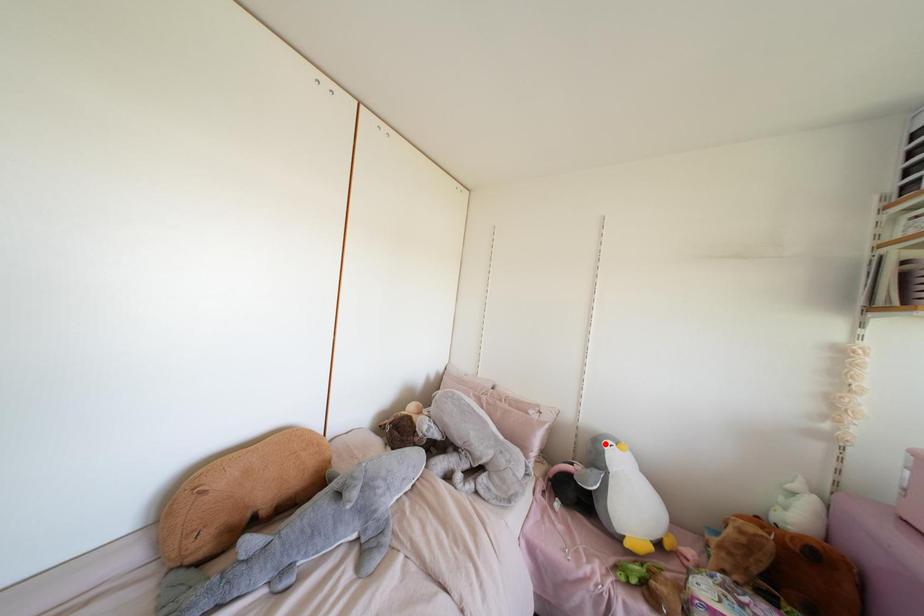
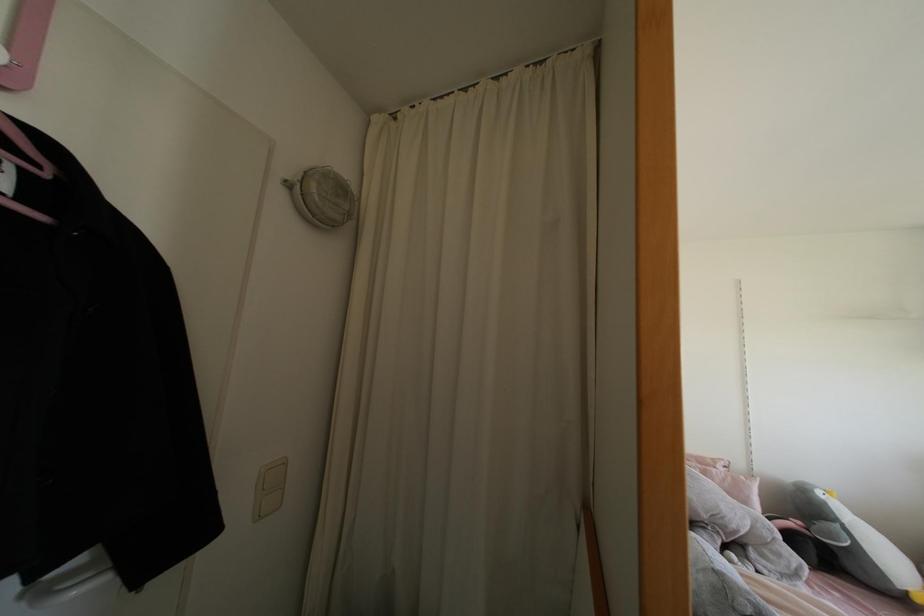
Question: A red point is marked in image1. In image2, is the corresponding 3D point closer to the camera or farther? Reply with the corresponding letter.

Choices:
 (A) The corresponding 3D point is closer.
 (B) The corresponding 3D point is farther.

Answer: (A)